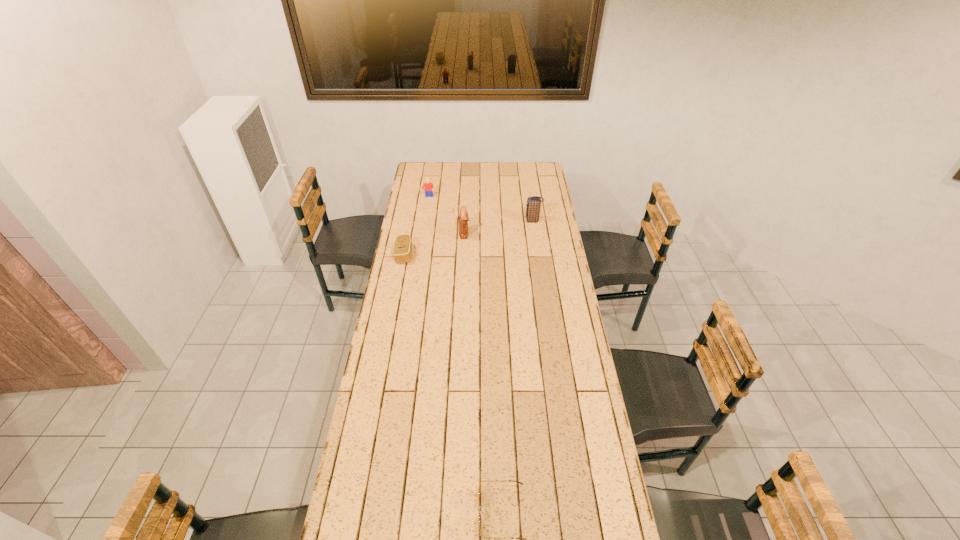
At what (x,y) coordinates should I click in order to perform the action: click on vacant space at the far right corner. Please return your answer as a coordinate pair (x, y). This screenshot has height=540, width=960. Looking at the image, I should click on (532, 170).

In order to click on vacant area that lies between the shortest clutch bag and the farthest object in this screenshot , I will do `click(417, 226)`.

Locate an element on the screen. The width and height of the screenshot is (960, 540). vacant area that lies between the third object from left to right and the rightmost object is located at coordinates (499, 227).

The width and height of the screenshot is (960, 540). Find the location of `vacant point located between the fourth nearest object and the Lego`. vacant point located between the fourth nearest object and the Lego is located at coordinates (481, 209).

Locate an element on the screen. The width and height of the screenshot is (960, 540). vacant region between the nearest clutch bag and the farthest object is located at coordinates (417, 226).

This screenshot has height=540, width=960. I want to click on free spot between the farthest object and the rightmost clutch bag, so click(x=481, y=209).

Image resolution: width=960 pixels, height=540 pixels. Identify the location of empty location between the fourth nearest object and the third object from right to left. (499, 227).

At what (x,y) coordinates should I click in order to perform the action: click on blank region between the shortest clutch bag and the third nearest object. Please return your answer as a coordinate pair (x, y). Image resolution: width=960 pixels, height=540 pixels. Looking at the image, I should click on (434, 244).

The image size is (960, 540). Find the location of `the closest object to the second nearest clutch bag`. the closest object to the second nearest clutch bag is located at coordinates (402, 250).

At what (x,y) coordinates should I click in order to perform the action: click on object that can be found as the third closest to the second object from right to left. Please return your answer as a coordinate pair (x, y). The width and height of the screenshot is (960, 540). Looking at the image, I should click on (533, 203).